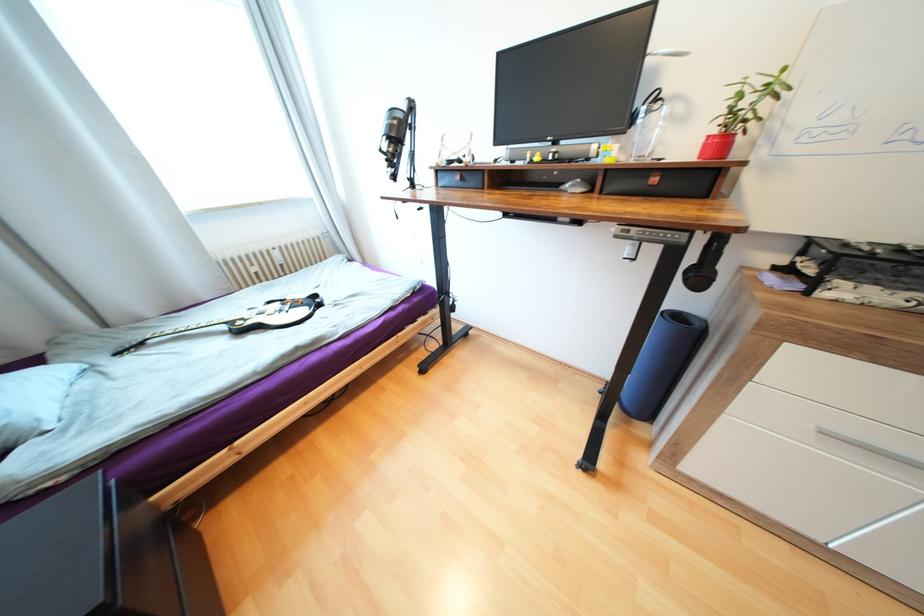
Which object does [248,320] point to?

It corresponds to the electric guitar in the image.